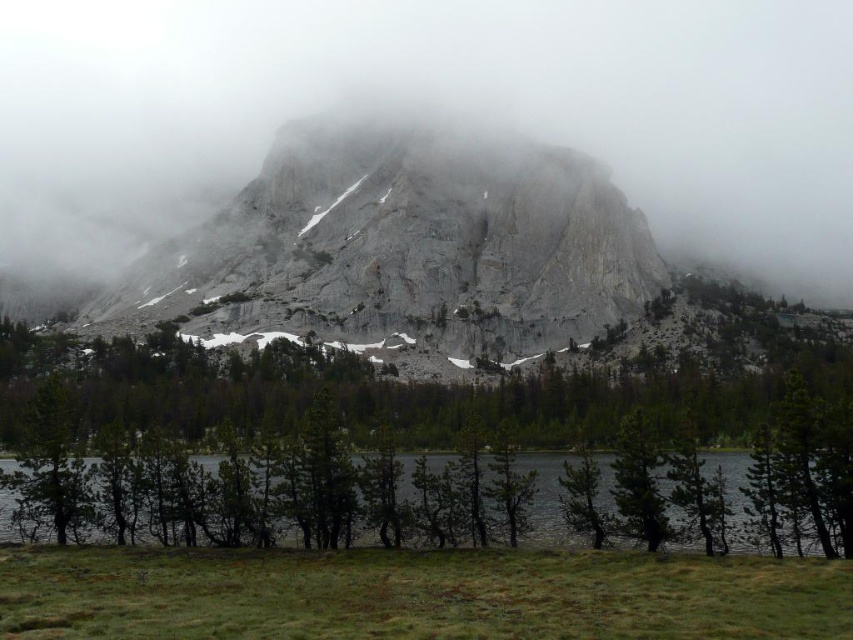
The height and width of the screenshot is (640, 853). Describe the element at coordinates (401, 252) in the screenshot. I see `gray rock mountain at center` at that location.

Is gray rock mountain at center positioned in front of green matte water at lower center?

No, it is behind green matte water at lower center.

Locate an element on the screen. This screenshot has height=640, width=853. gray rock mountain at center is located at coordinates (401, 252).

Where is `gray rock mountain at center`? The height and width of the screenshot is (640, 853). gray rock mountain at center is located at coordinates (401, 252).